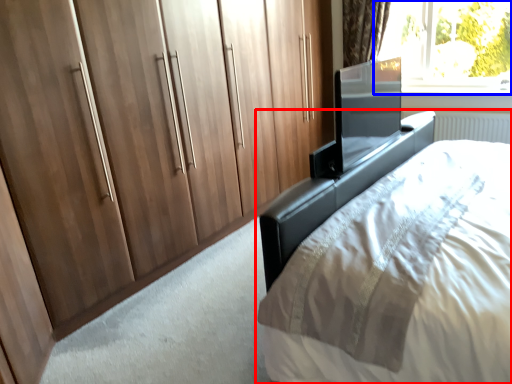
Question: Which of the following is the farthest to the observer, bed (highlighted by a red box) or window (highlighted by a blue box)?

Choices:
 (A) bed
 (B) window

Answer: (B)